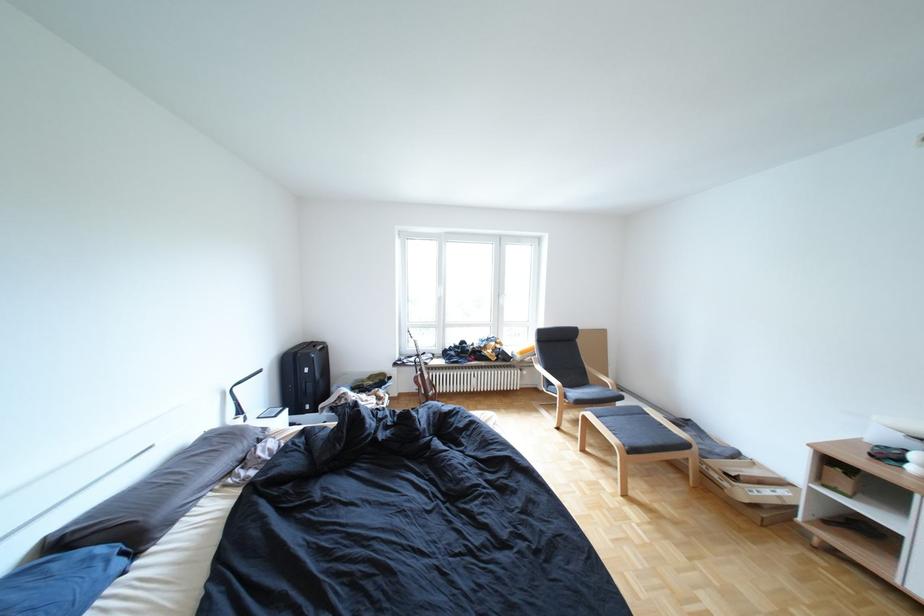
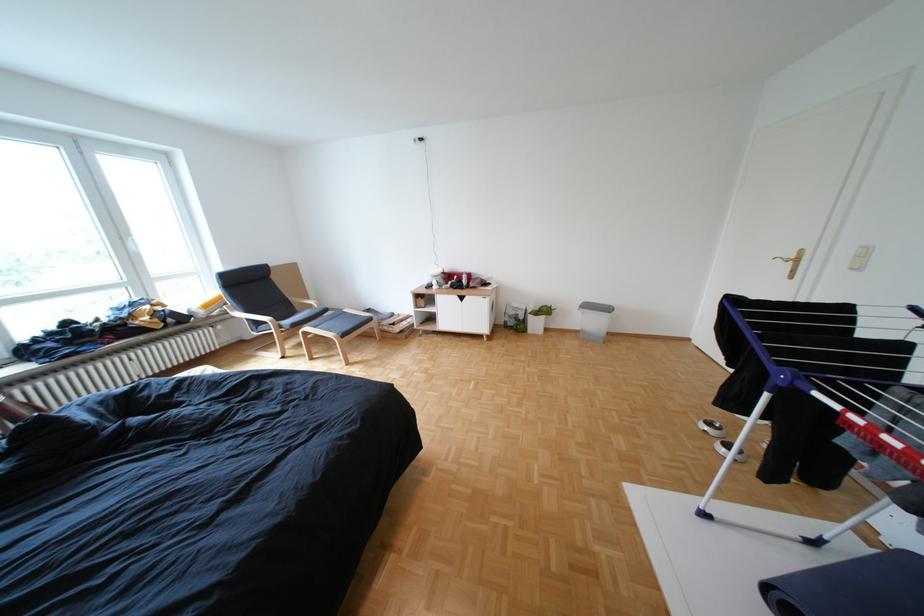
The point at (604, 415) is marked in the first image. Where is the corresponding point in the second image?

(322, 329)